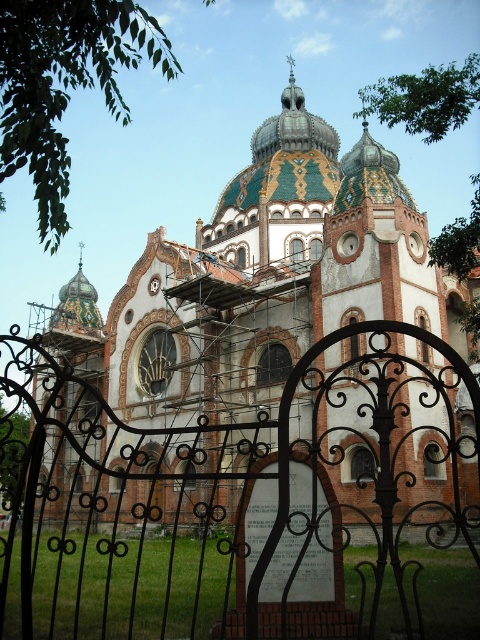
Can you confirm if black wrought iron gate at center is wider than brick church at center?

Correct, the width of black wrought iron gate at center exceeds that of brick church at center.

The image size is (480, 640). What do you see at coordinates (240, 504) in the screenshot? I see `black wrought iron gate at center` at bounding box center [240, 504].

This screenshot has width=480, height=640. What are the coordinates of `black wrought iron gate at center` in the screenshot? It's located at (240, 504).